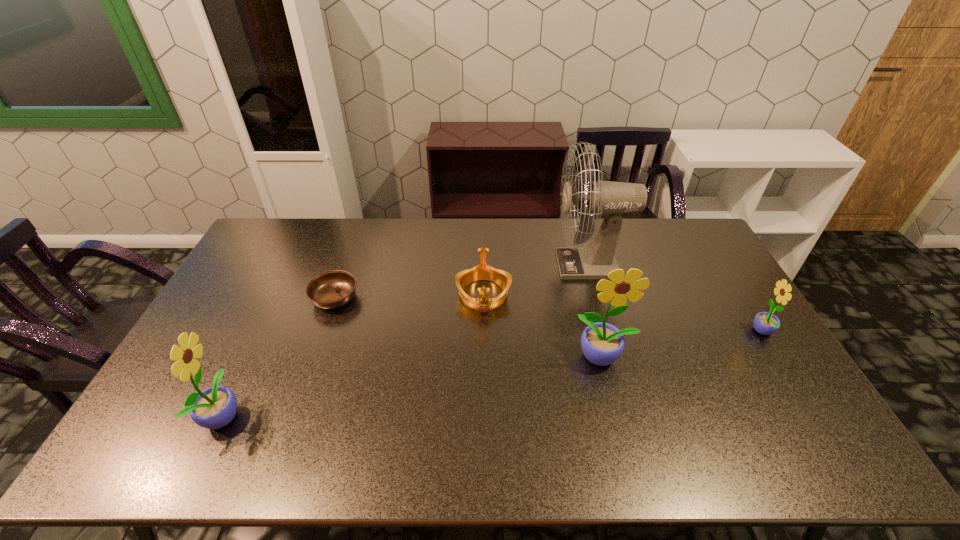
If we want them evenly spaced by inserting an extra sunflower among them, please locate a free spot for this new sunflower. Please provide its 2D coordinates. Your answer should be formatted as a tuple, i.e. [(x, y)], where the tuple contains the x and y coordinates of a point satisfying the conditions above.

[(424, 384)]